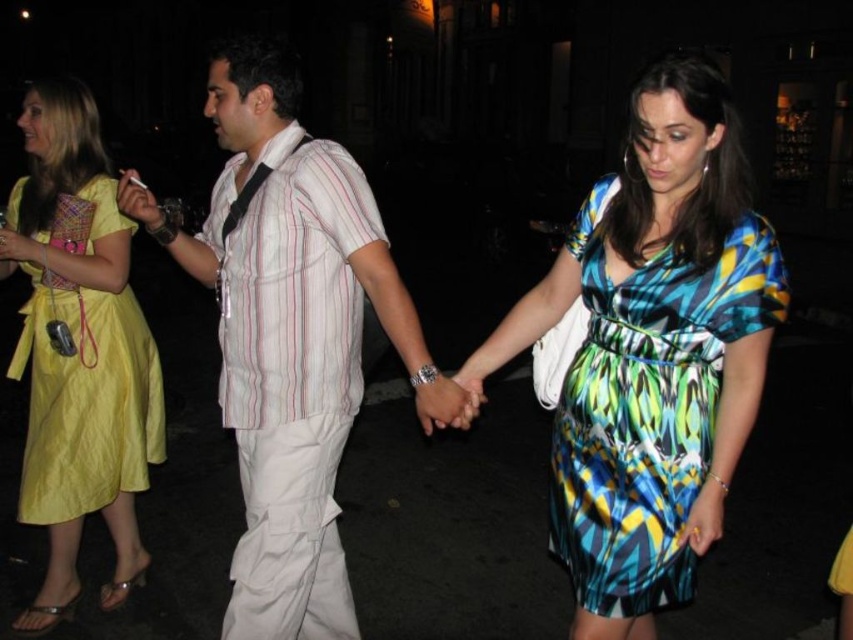
Does white striped shirt at center have a greater width compared to printed silk dress at center?

Indeed, white striped shirt at center has a greater width compared to printed silk dress at center.

Is point (316, 444) farther from viewer compared to point (566, 460)?

Yes, it is.

Does point (276, 385) come closer to viewer compared to point (666, 413)?

No, (276, 385) is behind (666, 413).

Where is `white striped shirt at center`? white striped shirt at center is located at coordinates [x=294, y=337].

Who is positioned more to the right, printed silk dress at center or yellow satin dress at left?

printed silk dress at center

Who is positioned more to the left, printed silk dress at center or yellow satin dress at left?

From the viewer's perspective, yellow satin dress at left appears more on the left side.

Identify the location of printed silk dress at center. The height and width of the screenshot is (640, 853). (647, 406).

Does white striped shirt at center have a greater height compared to matte black cigarette at center?

Yes.

Can you confirm if white striped shirt at center is bigger than matte black cigarette at center?

Yes.

Does point (393, 307) lie behind point (149, 214)?

No.

Find the location of a particular element. This screenshot has height=640, width=853. white striped shirt at center is located at coordinates (294, 337).